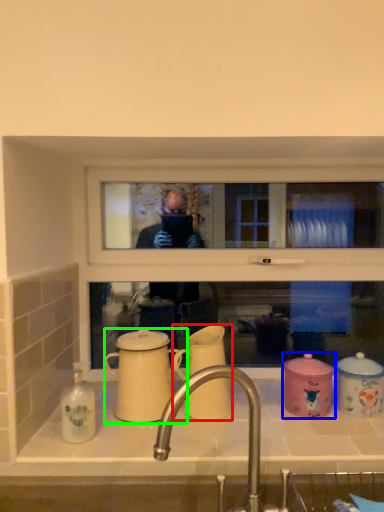
Question: Which is nearer to the coffee cup (highlighted by a red box)? coffee cup (highlighted by a blue box) or coffee cup (highlighted by a green box).

Choices:
 (A) coffee cup
 (B) coffee cup

Answer: (B)